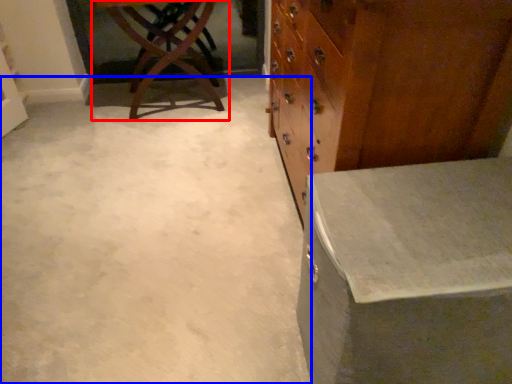
Question: Among these objects, which one is nearest to the camera, table (highlighted by a red box) or concrete (highlighted by a blue box)?

Choices:
 (A) table
 (B) concrete

Answer: (B)